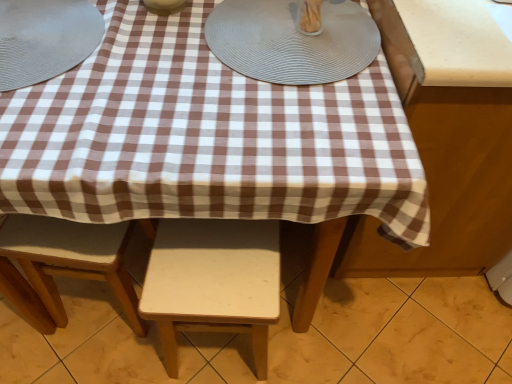
This screenshot has width=512, height=384. What are the coordinates of `vacant space in front of clear glass container at upper center, placed as the first tableware when sorted from right to left` in the screenshot? It's located at (309, 64).